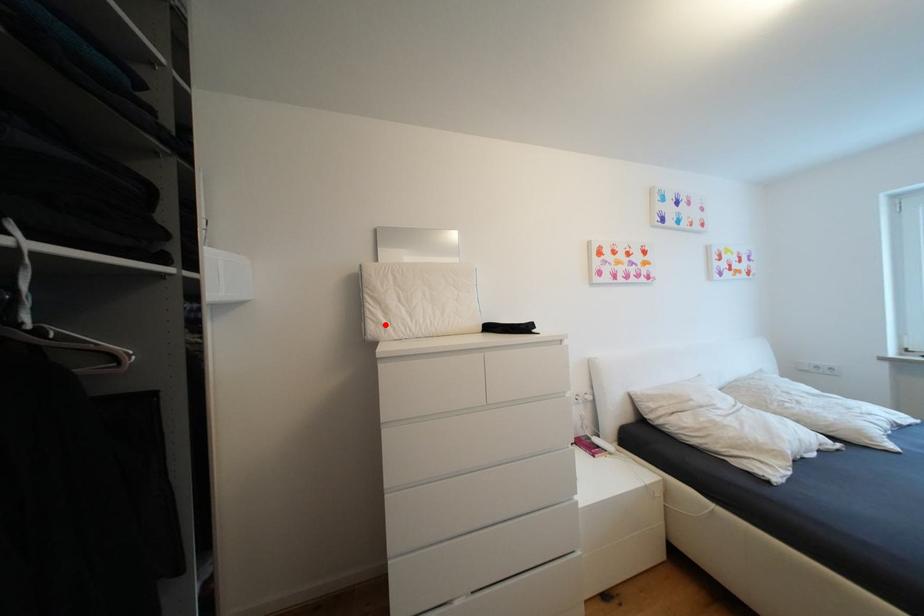
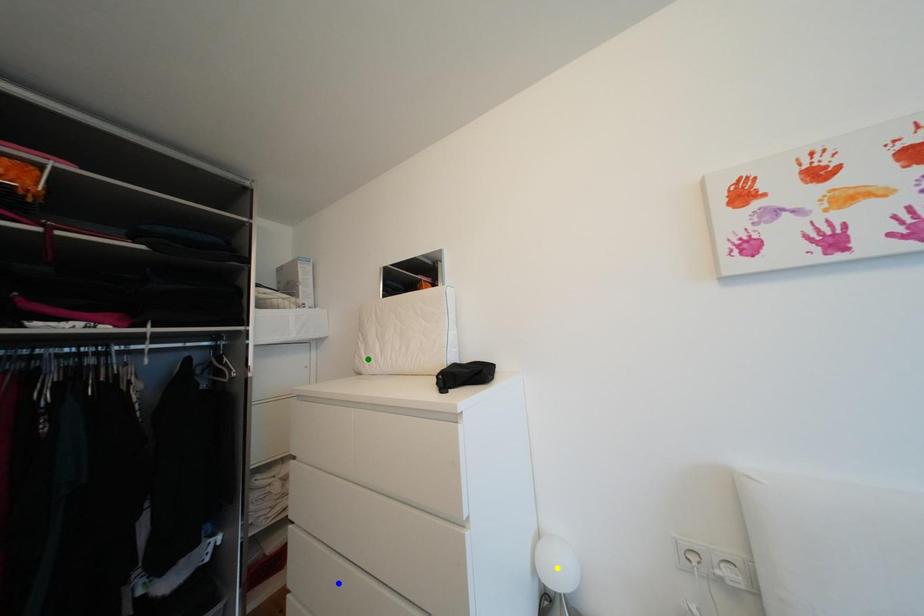
Question: I am providing you with two images of the same scene from different viewpoints. A red point is marked on the first image. You are given multiple points on the second image. In image 2, which mark is for the same physical point as the one in image 1?

Choices:
 (A) green point
 (B) blue point
 (C) yellow point

Answer: (A)